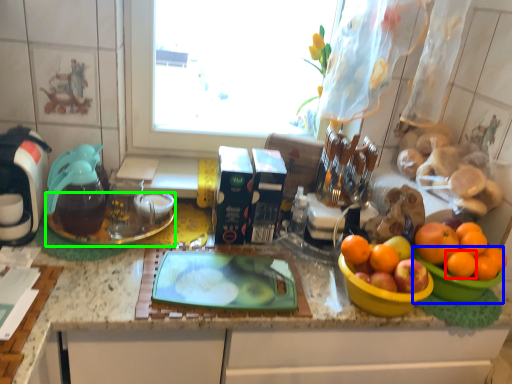
Question: Based on their relative distances, which object is nearer to orange (highlighted by a red box)? Choose from basin (highlighted by a blue box) and glass plate (highlighted by a green box).

Choices:
 (A) basin
 (B) glass plate

Answer: (A)